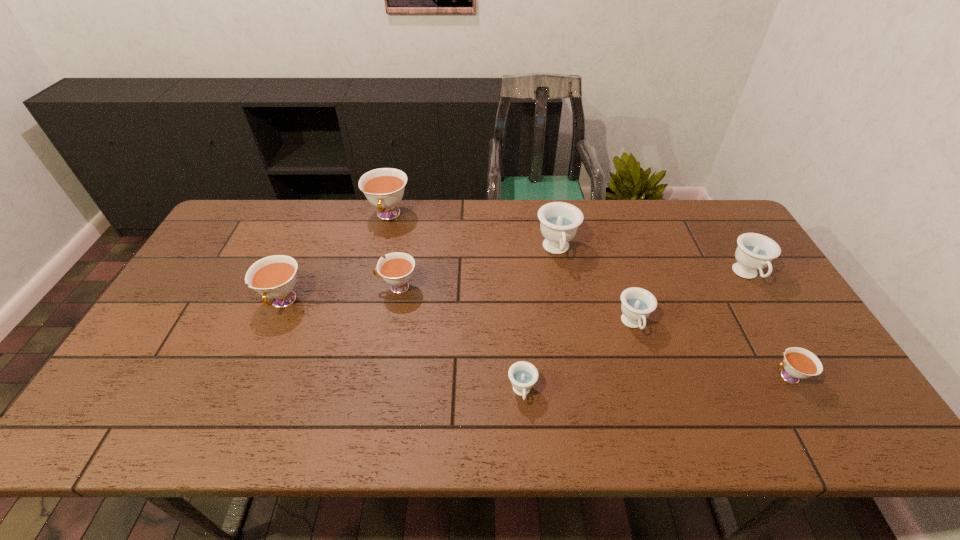
Locate an element on the screen. This screenshot has height=540, width=960. vacant area that lies between the fifth object from left to right and the third biggest white teacup is located at coordinates (477, 268).

This screenshot has height=540, width=960. Identify the location of object that can be found as the sixth closest to the rightmost blue teacup. (384, 188).

I want to click on object that is the sixth closest to the second nearest blue teacup, so click(x=384, y=188).

This screenshot has width=960, height=540. Find the location of `teacup that stands as the closest to the fourth teacup from left to right`. teacup that stands as the closest to the fourth teacup from left to right is located at coordinates click(x=637, y=303).

Image resolution: width=960 pixels, height=540 pixels. In order to click on teacup object that ranks as the fourth closest to the leftmost teacup in this screenshot , I will do `click(559, 221)`.

Point out which white teacup is positioned as the third nearest to the leftmost teacup. Please provide its 2D coordinates. Your answer should be formatted as a tuple, i.e. [(x, y)], where the tuple contains the x and y coordinates of a point satisfying the conditions above.

[(799, 363)]

This screenshot has height=540, width=960. I want to click on white teacup that stands as the third closest to the third teacup from right to left, so click(x=384, y=188).

Choose which blue teacup is the nearest neighbor to the third blue teacup from left to right. Please provide its 2D coordinates. Your answer should be formatted as a tuple, i.e. [(x, y)], where the tuple contains the x and y coordinates of a point satisfying the conditions above.

[(559, 221)]

Identify which blue teacup is located as the fourth nearest to the second smallest white teacup. Please provide its 2D coordinates. Your answer should be formatted as a tuple, i.e. [(x, y)], where the tuple contains the x and y coordinates of a point satisfying the conditions above.

[(755, 252)]

You are a GUI agent. You are given a task and a screenshot of the screen. Output one action in this format:
    pyautogui.click(x=<x>, y=<y>)
    Task: Click on the free space that satisfies the following two spatial constraints: 1. on the side of the rightmost blue teacup with the handle; 2. on the side of the nearest white teacup with the handle
    
    Given the screenshot: What is the action you would take?
    pyautogui.click(x=808, y=377)